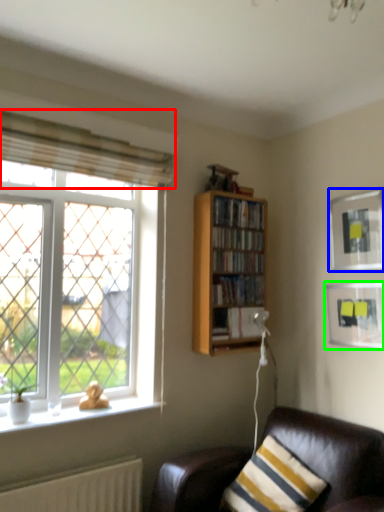
Question: Based on their relative distances, which object is nearer to curtain (highlighted by a red box)? Choose from picture frame (highlighted by a blue box) and picture frame (highlighted by a green box).

Choices:
 (A) picture frame
 (B) picture frame

Answer: (A)